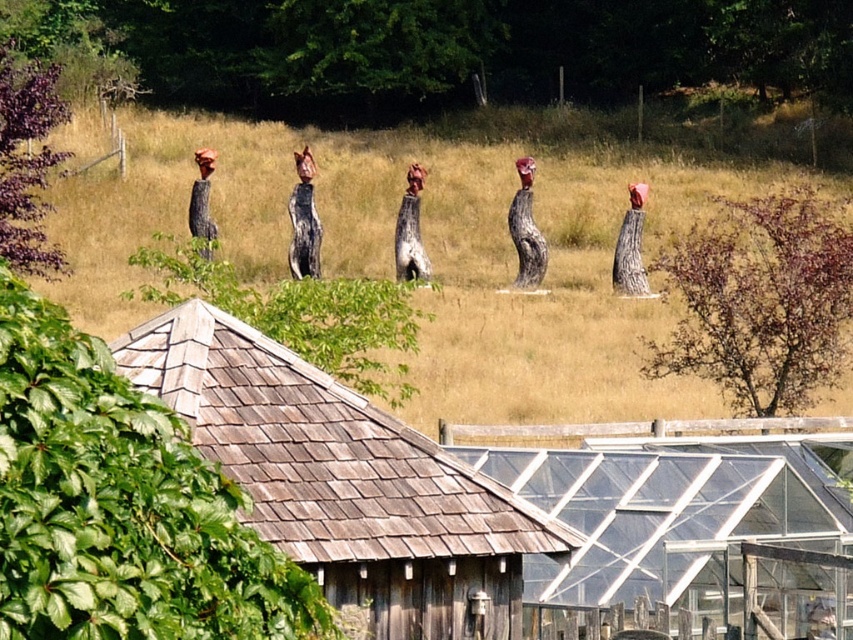
Does brown grass at center have a smaller size compared to wooden shingles at center?

No, brown grass at center is not smaller than wooden shingles at center.

Is brown grass at center positioned at the back of wooden shingles at center?

Yes, brown grass at center is further from the viewer.

Is point (379, 227) positioned after point (383, 422)?

Yes, it is behind point (383, 422).

Identify the location of brown grass at center. (427, 250).

Is brown grass at center bigger than wooden hut at center?

Yes.

Looking at this image, is brown grass at center shorter than wooden hut at center?

In fact, brown grass at center may be taller than wooden hut at center.

Which is behind, point (62, 244) or point (778, 636)?

The point (62, 244) is more distant.

Find the location of `brown grass at center`. brown grass at center is located at coordinates (427, 250).

Does wooden shingles at center have a greater height compared to wooden hut at center?

Correct, wooden shingles at center is much taller as wooden hut at center.

Who is more forward, (555, 518) or (566, 593)?

Point (555, 518) is more forward.

This screenshot has width=853, height=640. Describe the element at coordinates (345, 481) in the screenshot. I see `wooden shingles at center` at that location.

Image resolution: width=853 pixels, height=640 pixels. What are the coordinates of `wooden shingles at center` in the screenshot? It's located at (345, 481).